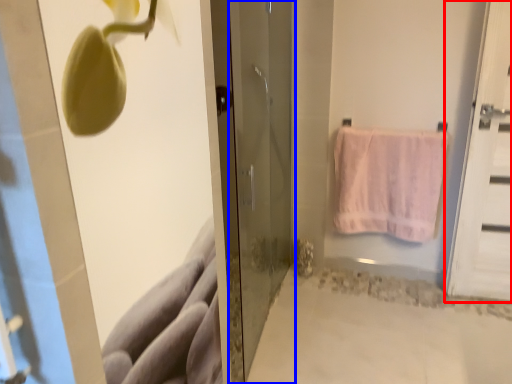
Question: Among these objects, which one is nearest to the camera, door (highlighted by a red box) or door (highlighted by a blue box)?

Choices:
 (A) door
 (B) door

Answer: (B)